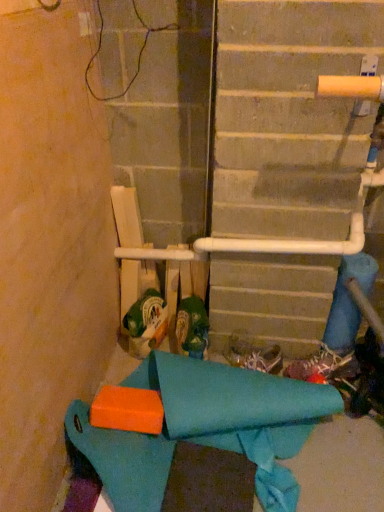
Question: From the image's perspective, relative to green fabric shoe at center, placed as the third footwear when sorted from right to left, is teal fabric at lower left above or below?

Choices:
 (A) below
 (B) above

Answer: (A)

Question: In the image, is teal fabric at lower left on the left side or the right side of green fabric shoe at center, marked as the 1th footwear in a left-to-right arrangement?

Choices:
 (A) left
 (B) right

Answer: (B)

Question: Which of these objects is positioned closest to the white textured shoe at lower right, the third footwear viewed from the left?

Choices:
 (A) green fabric shoe at center, marked as the 1th footwear in a left-to-right arrangement
 (B) white fabric shoe at center, the 2th footwear from the left
 (C) teal fabric at lower left

Answer: (B)

Question: Considering the real-world distances, which object is closest to the teal fabric at lower left?

Choices:
 (A) white textured shoe at lower right, the 1th footwear when ordered from right to left
 (B) green fabric shoe at center, placed as the third footwear when sorted from right to left
 (C) white fabric shoe at center, the 2th footwear from the left

Answer: (B)